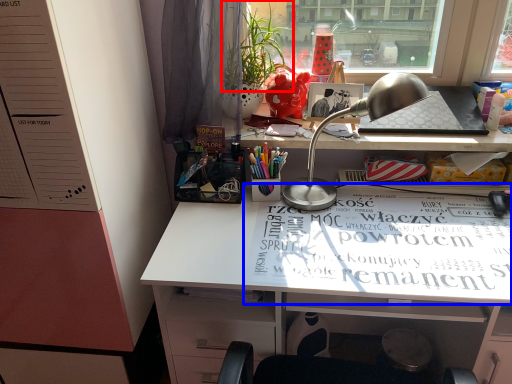
Question: Which point is further to the camera, plant (highlighted by a red box) or magazine (highlighted by a blue box)?

Choices:
 (A) plant
 (B) magazine

Answer: (A)